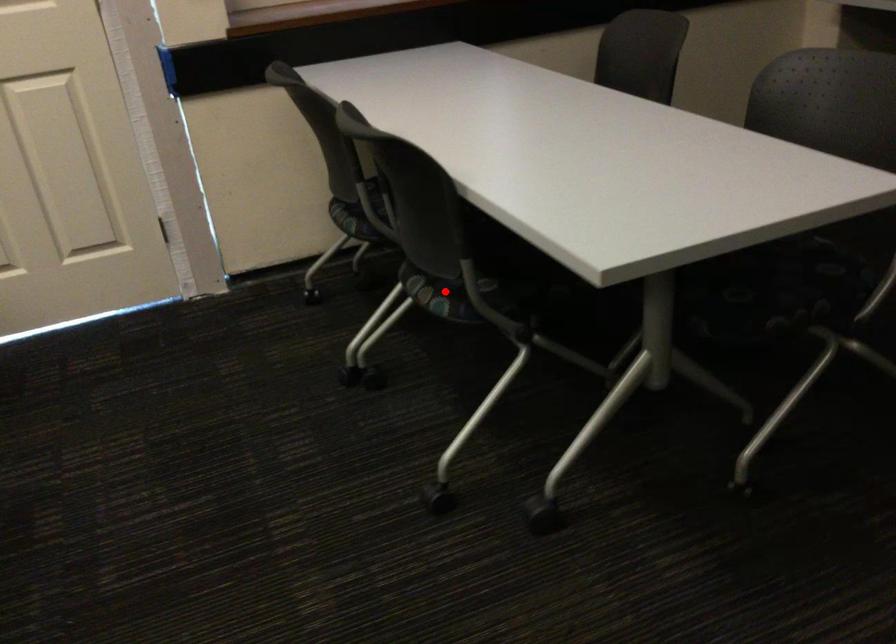
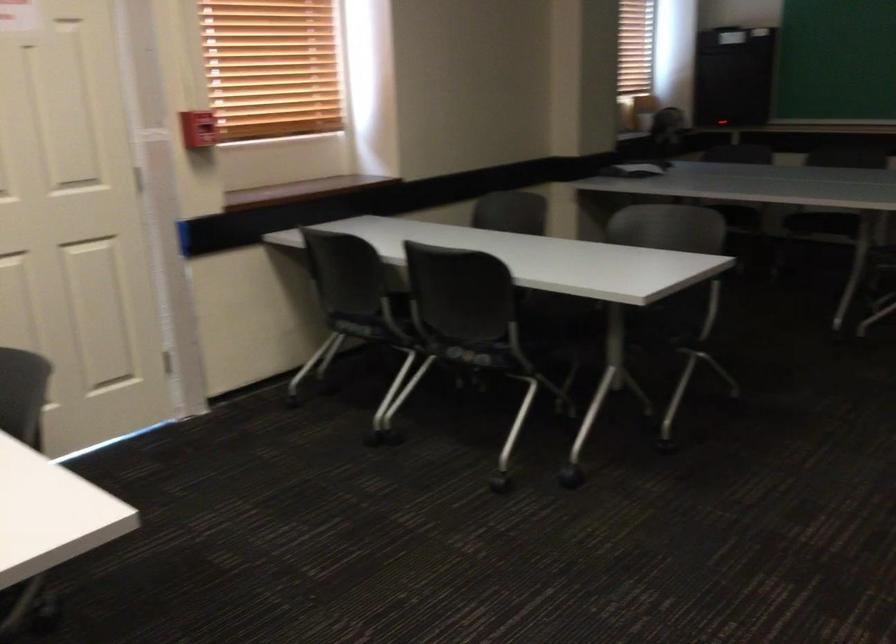
Question: I am providing you with two images of the same scene from different viewpoints. A red point is shown in image1. For the corresponding object point in image2, is it positioned nearer or farther from the camera?

Choices:
 (A) Nearer
 (B) Farther

Answer: (B)